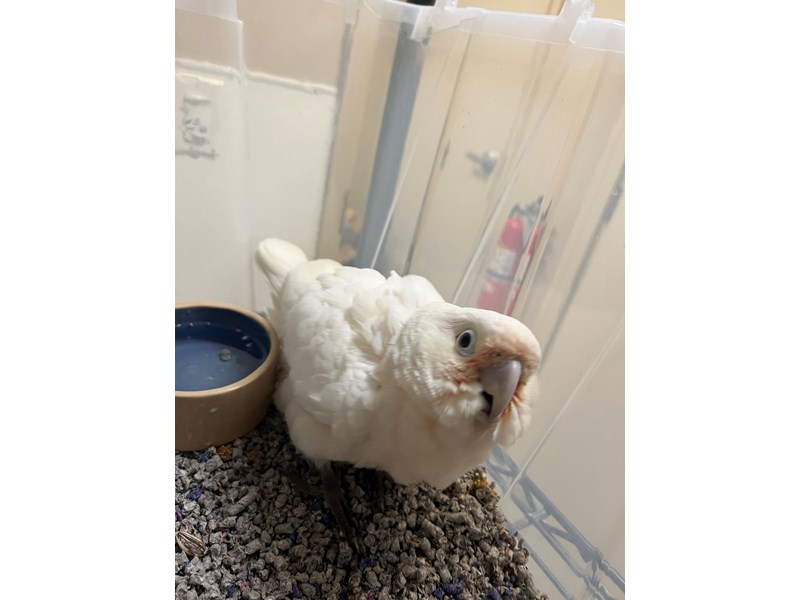
In order to click on fire extinguisher in this screenshot , I will do `click(517, 258)`.